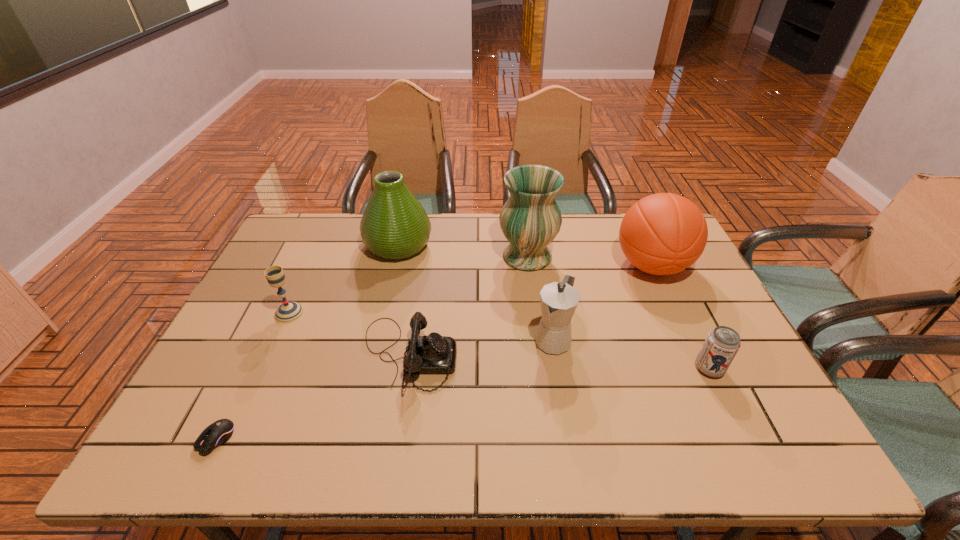
Locate an element on the screen. This screenshot has height=540, width=960. vacant region between the seventh tallest object and the shortest object is located at coordinates (312, 397).

You are a GUI agent. You are given a task and a screenshot of the screen. Output one action in this format:
    pyautogui.click(x=<x>, y=<y>)
    Task: Click on the vacant space that's between the sixth tallest object and the computer mouse
    
    Given the screenshot: What is the action you would take?
    pyautogui.click(x=463, y=404)

Identify the location of vacant region between the third shortest object and the fifth tallest object. This screenshot has width=960, height=540. (499, 341).

Find the location of a particular element. free point between the right vase and the left vase is located at coordinates (463, 251).

Locate an element on the screen. This screenshot has height=540, width=960. free space between the shortest object and the left vase is located at coordinates (307, 342).

Locate an element on the screen. free space between the fifth shortest object and the left vase is located at coordinates (475, 292).

The width and height of the screenshot is (960, 540). What are the coordinates of `vacant area that lies between the beer can and the fourth shortest object` in the screenshot? It's located at (499, 341).

What are the coordinates of `free space between the fifth tallest object and the left vase` in the screenshot? It's located at (344, 279).

Find the location of `vacant area that lies between the coffeepot and the telephone`. vacant area that lies between the coffeepot and the telephone is located at coordinates (480, 347).

Image resolution: width=960 pixels, height=540 pixels. Identify the location of object that stands as the third closest to the beer can. (530, 219).